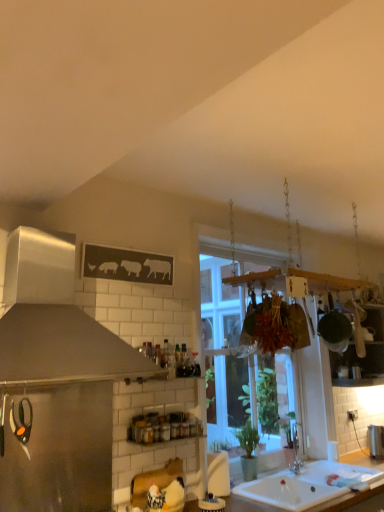
Question: Considering the relative sizes of matte black scissors at left, which ranks as the 3th appliance in bottom-to-top order, and white ceramic sink at lower center in the image provided, is matte black scissors at left, which ranks as the 3th appliance in bottom-to-top order, wider than white ceramic sink at lower center?

Choices:
 (A) yes
 (B) no

Answer: (B)

Question: Is matte black scissors at left, which ranks as the first appliance in left-to-right order, positioned before white ceramic sink at lower center?

Choices:
 (A) yes
 (B) no

Answer: (A)

Question: From the image's perspective, is matte black scissors at left, which ranks as the 3th appliance in bottom-to-top order, above white ceramic sink at lower center?

Choices:
 (A) yes
 (B) no

Answer: (A)

Question: Is matte black scissors at left, which appears as the second appliance when viewed from the back, far away from white ceramic sink at lower center?

Choices:
 (A) no
 (B) yes

Answer: (B)

Question: Is matte black scissors at left, which ranks as the 3th appliance in bottom-to-top order, completely or partially outside of white ceramic sink at lower center?

Choices:
 (A) no
 (B) yes

Answer: (B)

Question: From the image's perspective, is matte black scissors at left, which ranks as the third appliance in right-to-left order, located beneath white ceramic sink at lower center?

Choices:
 (A) yes
 (B) no

Answer: (B)

Question: Is clear glass window at center shorter than white glossy countertop at lower center?

Choices:
 (A) yes
 (B) no

Answer: (B)

Question: Is clear glass window at center closer to camera compared to white glossy countertop at lower center?

Choices:
 (A) yes
 (B) no

Answer: (B)

Question: From the image's perspective, would you say clear glass window at center is shown under white glossy countertop at lower center?

Choices:
 (A) yes
 (B) no

Answer: (B)

Question: From the image's perspective, is clear glass window at center over white glossy countertop at lower center?

Choices:
 (A) yes
 (B) no

Answer: (A)

Question: Does clear glass window at center lie behind white glossy countertop at lower center?

Choices:
 (A) yes
 (B) no

Answer: (A)

Question: From a real-world perspective, is clear glass window at center located higher than white glossy countertop at lower center?

Choices:
 (A) no
 (B) yes

Answer: (B)

Question: Is brushed metal trash can at lower right, acting as the 3th appliance starting from the left, closer to camera compared to matte black scissors at left, which ranks as the third appliance in right-to-left order?

Choices:
 (A) yes
 (B) no

Answer: (B)